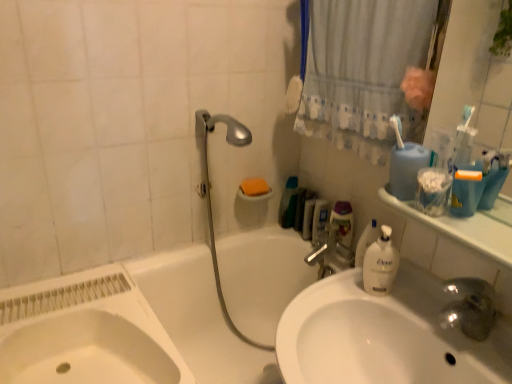
Question: Choose the correct answer: Is translucent plastic bottle at upper right inside silver metallic shower head at upper center or outside it?

Choices:
 (A) inside
 (B) outside

Answer: (B)

Question: From the image's perspective, relative to silver metallic shower head at upper center, is translucent plastic bottle at upper right above or below?

Choices:
 (A) below
 (B) above

Answer: (B)

Question: Based on their relative distances, which object is nearer to the white glossy sink at lower left, acting as the first sink starting from the left?

Choices:
 (A) clear plastic mouthwash at upper right, which appears as the first mouthwash when viewed from the back
 (B) translucent plastic container at center
 (C) white glossy bathtub at center
 (D) orange matte cup at right, which ranks as the third mouthwash in left-to-right order
 (E) silver metallic shower head at upper center

Answer: (C)

Question: Considering the real-world distances, which object is farthest from the white glossy countertop at upper right?

Choices:
 (A) white glossy bathtub at center
 (B) blue plastic container at upper right, which is counted as the 2th mouthwash, starting from the right
 (C) white glossy sink at center, which is the 1th sink in right-to-left order
 (D) silver metallic shower head at upper center
 (E) white glossy sink at lower left, acting as the first sink starting from the left

Answer: (E)